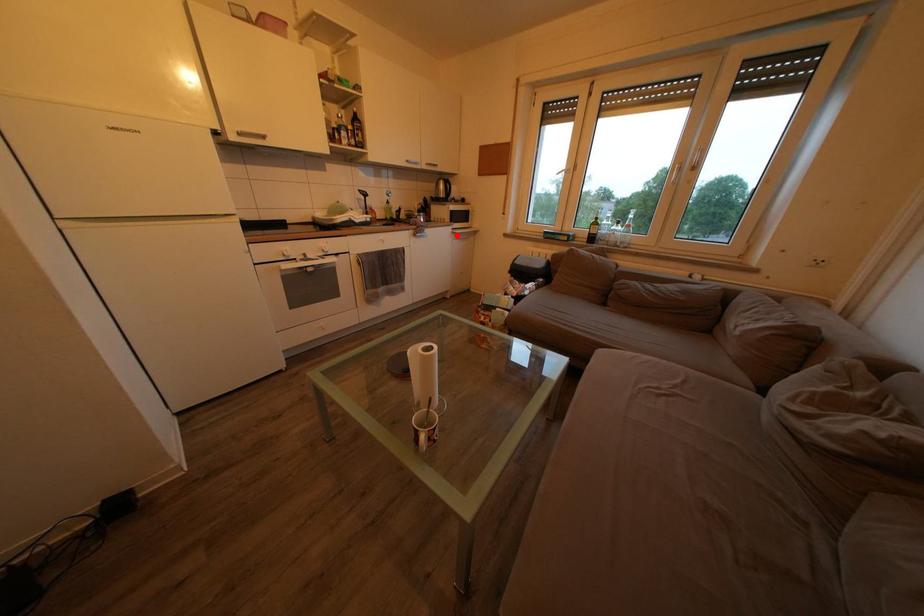
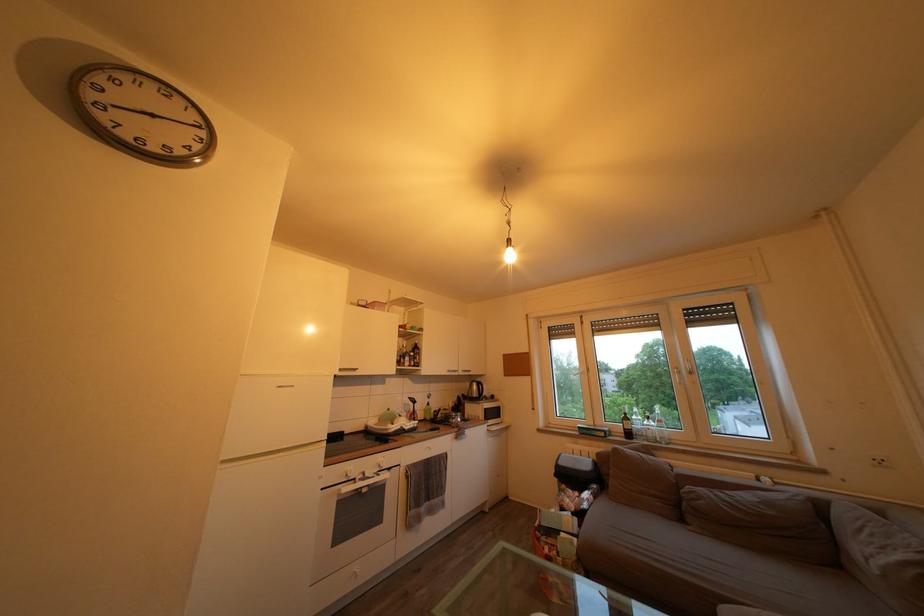
Where in the second image is the point corresponding to the highlighted location from the first image?

(492, 434)